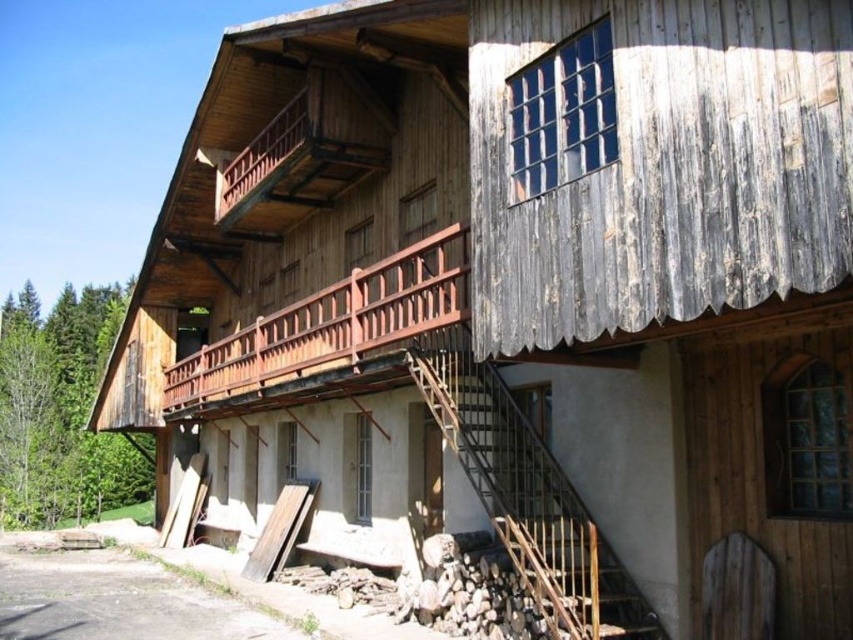
Question: Which of the following is the farthest from the observer?

Choices:
 (A) brown wooden balcony at center
 (B) brown wooden balcony at upper center

Answer: (B)

Question: Observing the image, what is the correct spatial positioning of brown wooden balcony at center in reference to brown wooden balcony at upper center?

Choices:
 (A) below
 (B) above

Answer: (A)

Question: Which point appears farthest from the camera in this image?

Choices:
 (A) (561, 625)
 (B) (405, 266)
 (C) (273, 129)

Answer: (C)

Question: Does rusty metal staircase at lower right have a lesser width compared to brown wooden balcony at center?

Choices:
 (A) yes
 (B) no

Answer: (A)

Question: Which point is farther from the camera taking this photo?

Choices:
 (A) (454, 429)
 (B) (360, 120)

Answer: (B)

Question: Can you confirm if brown wooden balcony at center is smaller than brown wooden balcony at upper center?

Choices:
 (A) yes
 (B) no

Answer: (B)